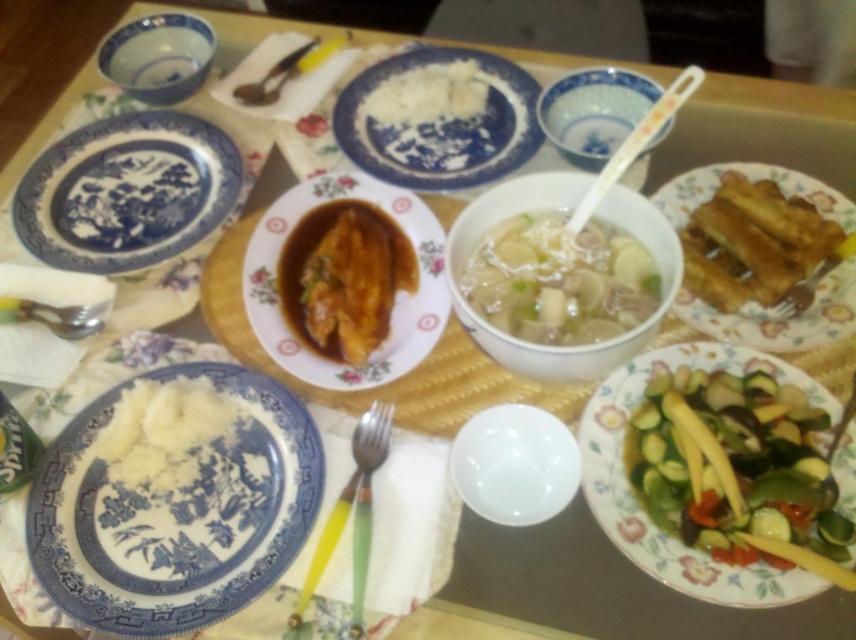
You are a server at a restaurant and need to place a new dish on the table. The dish is 12 inches wide. Looking at the table setup, can the blue porcelain plate at center accommodate this dish in terms of width? Please consider the space available and the size of the white creamy mashed potato at lower left.

The blue porcelain plate at center has a larger width than the white creamy mashed potato at lower left. However, the question is about accommodating a 12 inch wide dish. Without knowing the exact width of the blue porcelain plate, we cannot definitively say if it can fit. The answer should be that the information provided isn